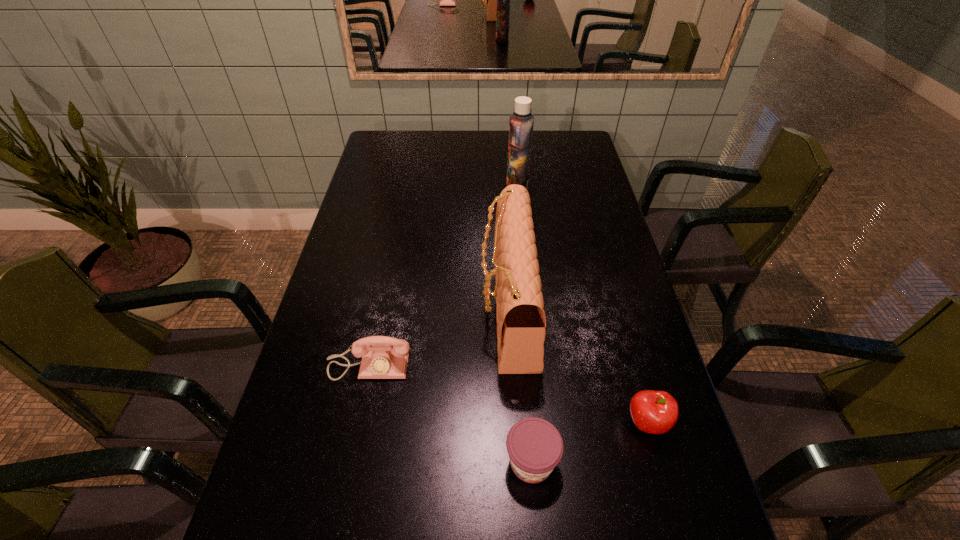
This screenshot has height=540, width=960. Identify the location of vacant region located 0.290m on the front-facing side of the handbag. (376, 308).

Find the location of a particular element. free space located 0.290m on the front-facing side of the handbag is located at coordinates (376, 308).

This screenshot has height=540, width=960. Identify the location of free point located 0.120m on the back of the apple. (x=630, y=361).

At what (x,y) coordinates should I click in order to perform the action: click on free space located on the dial of the leftmost object. Please return your answer as a coordinate pair (x, y). This screenshot has height=540, width=960. Looking at the image, I should click on (x=362, y=400).

You are a GUI agent. You are given a task and a screenshot of the screen. Output one action in this format:
    pyautogui.click(x=<x>, y=<y>)
    Task: Click on the free region located on the front label of the jam
    This screenshot has height=540, width=960.
    Given the screenshot: What is the action you would take?
    pyautogui.click(x=538, y=534)

Locate an element on the screen. object that is at the left edge is located at coordinates (383, 357).

Find the location of a particular element. This screenshot has height=540, width=960. object positioned at the right edge is located at coordinates (656, 412).

The width and height of the screenshot is (960, 540). I want to click on free space at the far edge, so click(x=459, y=130).

Identify the location of vacant space at the left edge. Image resolution: width=960 pixels, height=540 pixels. (370, 301).

At what (x,y) coordinates should I click in order to perform the action: click on vacant point at the right edge. Please return your answer as a coordinate pair (x, y). This screenshot has width=960, height=540. Looking at the image, I should click on (617, 335).